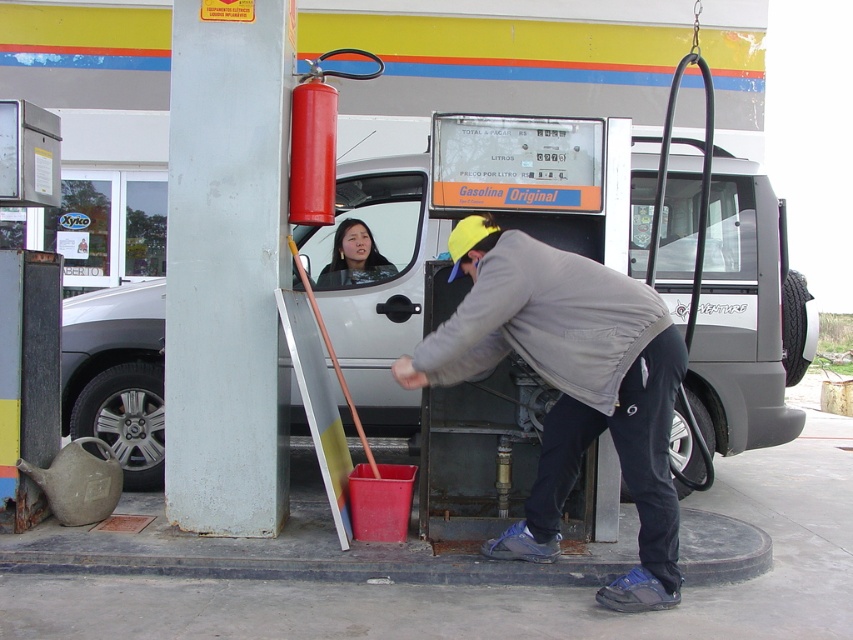
Question: Which of the following is the closest to the observer?

Choices:
 (A) matte black jacket at center
 (B) red matte fire extinguisher at upper left
 (C) gray fabric jacket at lower center
 (D) silver metallic van at center

Answer: (C)

Question: Where is red matte fire extinguisher at upper left located in relation to matte black jacket at center in the image?

Choices:
 (A) above
 (B) below

Answer: (A)

Question: From the image, what is the correct spatial relationship of gray fabric jacket at lower center in relation to matte black jacket at center?

Choices:
 (A) right
 (B) left

Answer: (A)

Question: Which object appears closest to the camera in this image?

Choices:
 (A) silver metallic van at center
 (B) red matte fire extinguisher at upper left

Answer: (B)

Question: Which object is closer to the camera taking this photo?

Choices:
 (A) silver metallic van at center
 (B) red matte fire extinguisher at upper left
 (C) gray fabric jacket at lower center
 (D) matte black jacket at center

Answer: (C)

Question: Can you confirm if gray fabric jacket at lower center is positioned below matte black jacket at center?

Choices:
 (A) no
 (B) yes

Answer: (B)